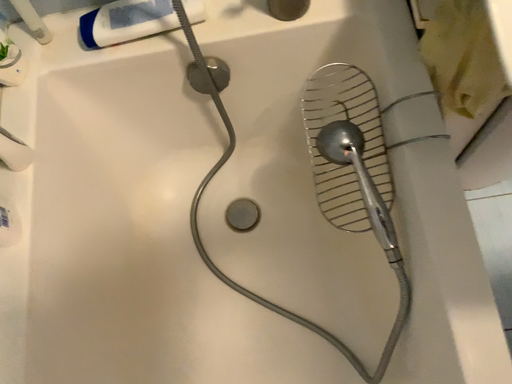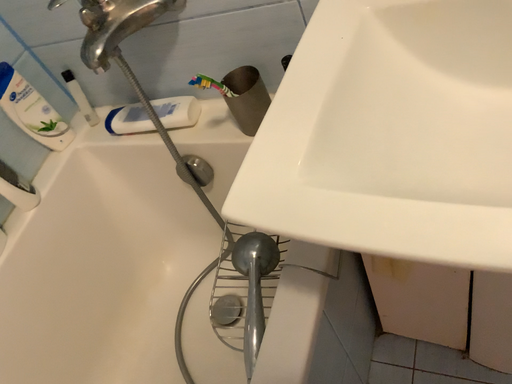
Question: Which way did the camera rotate in the video?

Choices:
 (A) rotated right
 (B) rotated left

Answer: (B)